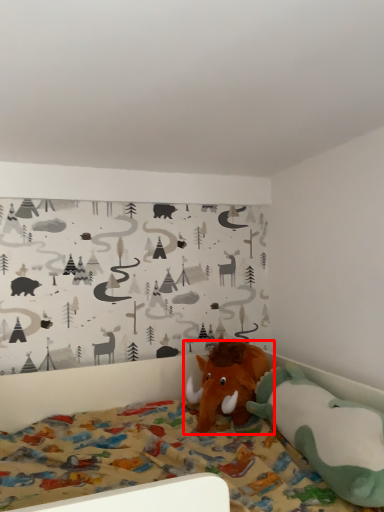
Question: From the image, what is the correct spatial relationship of toy (annotated by the red box) in relation to toy?

Choices:
 (A) right
 (B) left

Answer: (B)